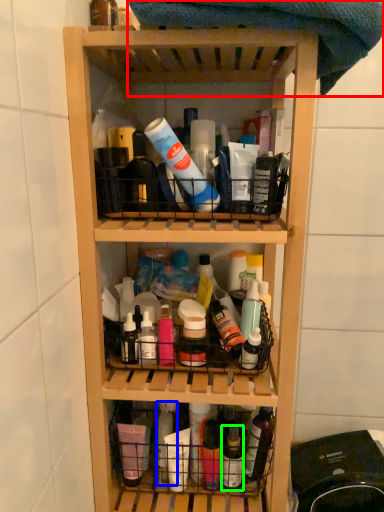
Question: Which is nearer to the beach towel (highlighted by a red box)? bottle (highlighted by a blue box) or bottle (highlighted by a green box).

Choices:
 (A) bottle
 (B) bottle

Answer: (A)